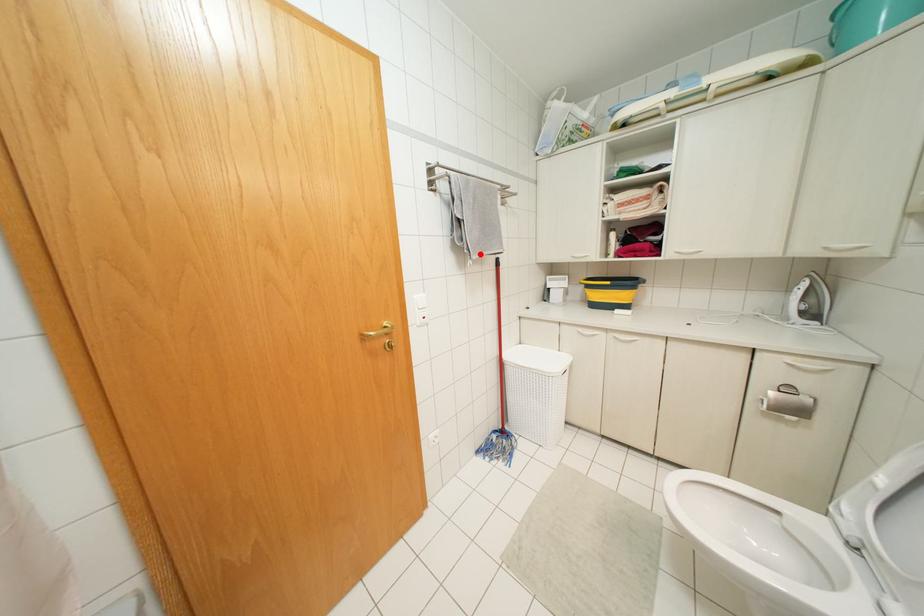
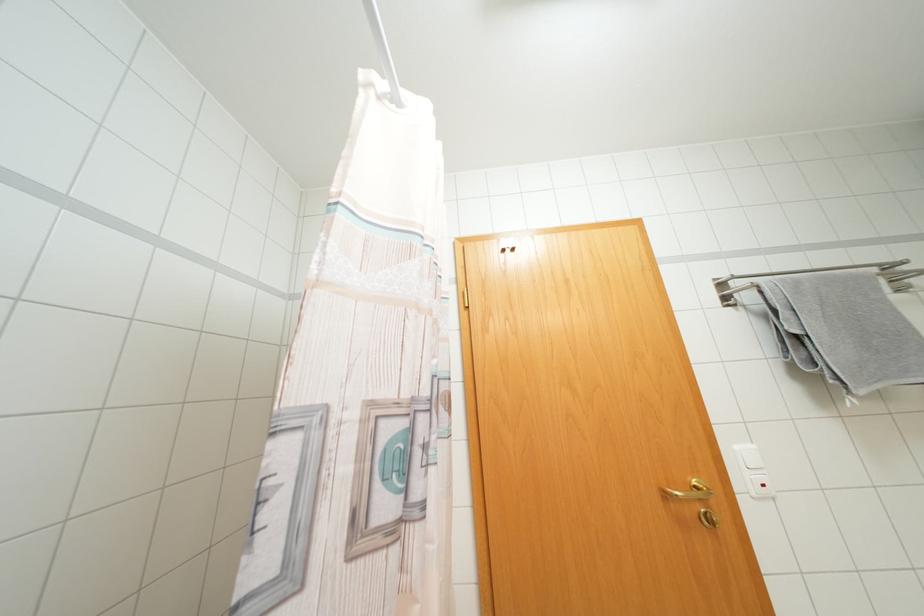
The point at the highlighted location is marked in the first image. Where is the corresponding point in the second image?

(877, 386)